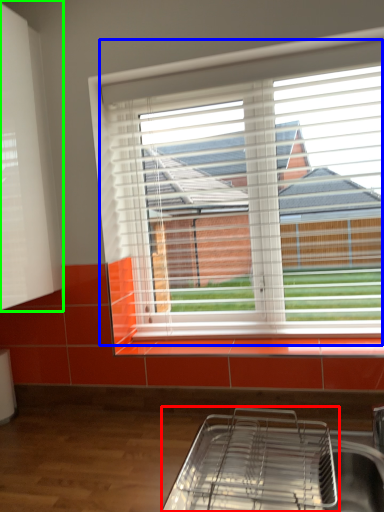
Question: Which is nearer to the appliance (highlighted by a red box)? window (highlighted by a blue box) or shutter (highlighted by a green box).

Choices:
 (A) window
 (B) shutter

Answer: (A)